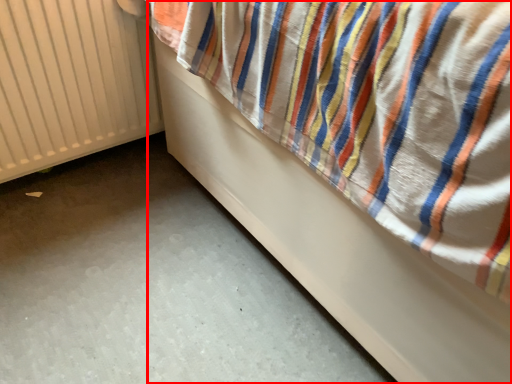
Question: Where is furniture (annotated by the red box) located in relation to radiator in the image?

Choices:
 (A) left
 (B) right

Answer: (B)